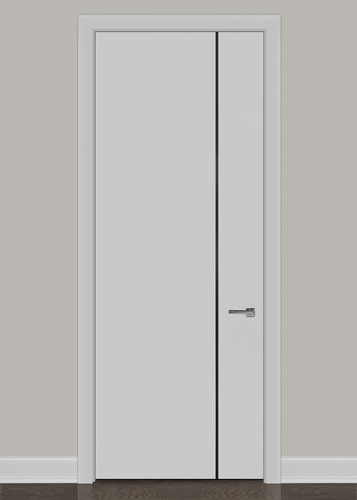
The image size is (357, 500). Identify the location of right side of door. (243, 224).